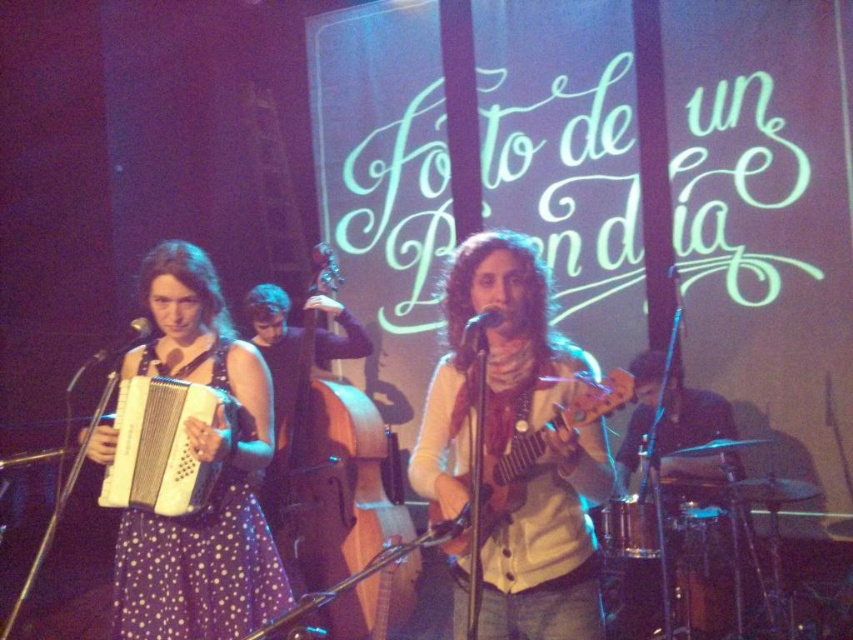
Does wooden ukulele at center have a greater width compared to wooden cello at center?

No, wooden ukulele at center is not wider than wooden cello at center.

Between wooden ukulele at center and wooden cello at center, which one appears on the left side from the viewer's perspective?

wooden cello at center

Which is behind, point (519, 292) or point (363, 564)?

Point (363, 564)

You are a GUI agent. You are given a task and a screenshot of the screen. Output one action in this format:
    pyautogui.click(x=<x>, y=<y>)
    Task: Click on the wooden ukulele at center
    
    Given the screenshot: What is the action you would take?
    pyautogui.click(x=492, y=364)

Who is lower down, wooden ukulele at center or smooth brown drum set at lower right?

smooth brown drum set at lower right

Who is more distant from viewer, (430, 456) or (697, 422)?

Positioned behind is point (697, 422).

The height and width of the screenshot is (640, 853). I want to click on wooden ukulele at center, so click(492, 364).

Does matte white accordion at left have a smaller size compared to smooth brown drum set at lower right?

Yes, matte white accordion at left is smaller than smooth brown drum set at lower right.

Between matte white accordion at left and smooth brown drum set at lower right, which one appears on the right side from the viewer's perspective?

Positioned to the right is smooth brown drum set at lower right.

The height and width of the screenshot is (640, 853). What are the coordinates of `matte white accordion at left` in the screenshot? It's located at (165, 442).